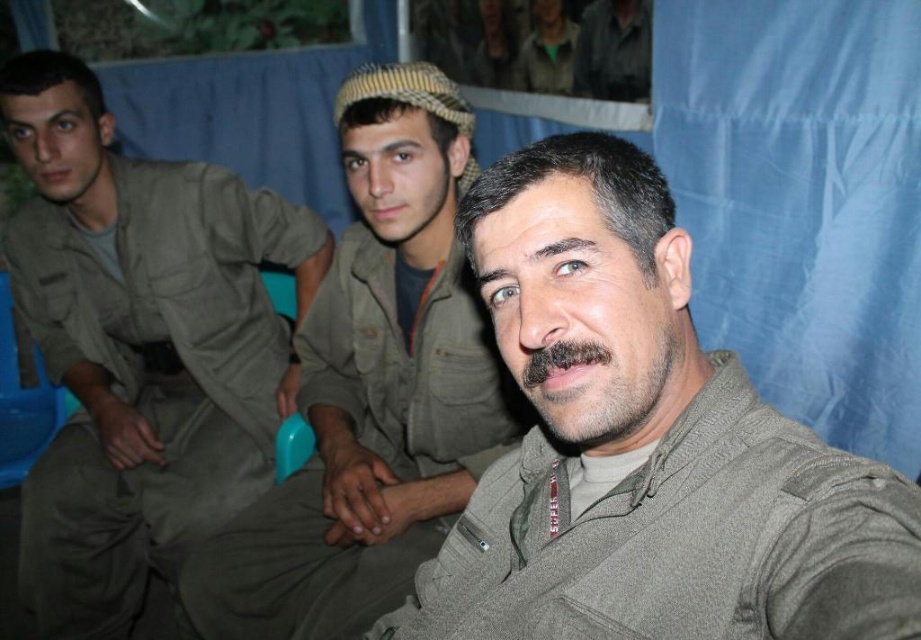
Question: Which is nearer to the dark brown fuzzy beard at center?

Choices:
 (A) matte khaki uniform at left
 (B) gray woolen jacket at center

Answer: (B)

Question: Is matte khaki uniform at left smaller than dark brown fuzzy beard at center?

Choices:
 (A) no
 (B) yes

Answer: (A)

Question: Which is nearer to the gray woolen jacket at center?

Choices:
 (A) matte khaki uniform at center
 (B) matte khaki uniform at left

Answer: (A)

Question: Is gray woolen jacket at center wider than dark brown fuzzy beard at center?

Choices:
 (A) no
 (B) yes

Answer: (B)

Question: Based on their relative distances, which object is farther from the dark brown fuzzy beard at center?

Choices:
 (A) matte khaki uniform at center
 (B) gray woolen jacket at center
 (C) matte khaki uniform at left

Answer: (C)

Question: Is matte khaki uniform at center closer to camera compared to dark brown fuzzy beard at center?

Choices:
 (A) yes
 (B) no

Answer: (B)